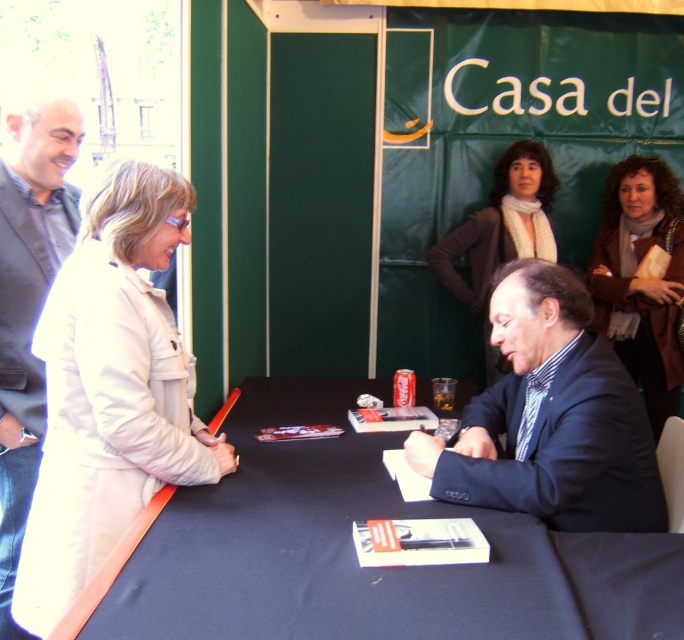
From the picture: You are a photographer holding a camera. You want to take a photo of the dark blue fabric table at center from a distance that allows you to capture the entire table in the frame. Given that the camera has a standard lens with a focal length of 50mm and the table is 1.2 meters wide, what is the minimum distance you should stand from the table to ensure the entire width fits in the frame?

The dark blue fabric table at center and camera are 1.05 meters apart. To capture the entire 1.2 meter width of the table with a 50mm lens, the minimum distance should be at least 1.2 meters divided by the lens field of view. However, since the existing distance is 1.05 meters, which is closer than required, the photographer should move back to at least 1.2 meters to ensure the table fits within the frame.

You are a photographer at the book signing event and need to capture a clear shot of the dark blue fabric table at center and the dark blue suit at center. Since both are dark blue, how can you distinguish them in your photo?

The dark blue fabric table at center is positioned under the dark blue suit at center, so in the photo, the dark blue suit at center will appear above the dark blue fabric table at center, making them distinguishable by their vertical positions.